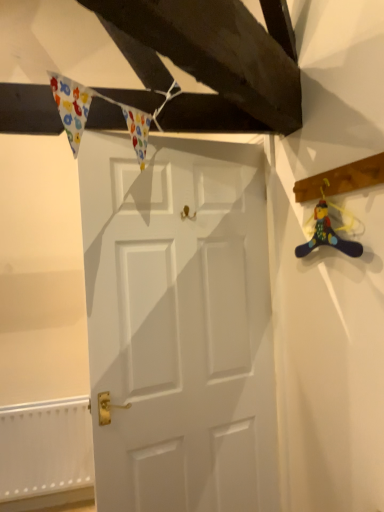
Question: Is wooden plank at upper right positioned behind white matte door at center?

Choices:
 (A) yes
 (B) no

Answer: (B)

Question: Is wooden plank at upper right outside white matte door at center?

Choices:
 (A) yes
 (B) no

Answer: (A)

Question: Is there a large distance between wooden plank at upper right and white matte door at center?

Choices:
 (A) no
 (B) yes

Answer: (A)

Question: Considering the relative positions of wooden plank at upper right and white matte door at center in the image provided, is wooden plank at upper right to the right of white matte door at center from the viewer's perspective?

Choices:
 (A) no
 (B) yes

Answer: (B)

Question: From a real-world perspective, is wooden plank at upper right on top of white matte door at center?

Choices:
 (A) no
 (B) yes

Answer: (B)

Question: From the image's perspective, is wooden plank at upper right on white matte door at center?

Choices:
 (A) no
 (B) yes

Answer: (B)

Question: From the image's perspective, is wooden plank at upper right located beneath matte plastic toy at right?

Choices:
 (A) no
 (B) yes

Answer: (A)

Question: Is wooden plank at upper right at the left side of matte plastic toy at right?

Choices:
 (A) yes
 (B) no

Answer: (B)

Question: Is wooden plank at upper right positioned behind matte plastic toy at right?

Choices:
 (A) no
 (B) yes

Answer: (A)

Question: Is wooden plank at upper right far from matte plastic toy at right?

Choices:
 (A) no
 (B) yes

Answer: (A)

Question: Is wooden plank at upper right facing away from matte plastic toy at right?

Choices:
 (A) yes
 (B) no

Answer: (B)

Question: Is wooden plank at upper right aimed at matte plastic toy at right?

Choices:
 (A) yes
 (B) no

Answer: (B)

Question: Is white textured radiator at lower left turned away from matte plastic toy at right?

Choices:
 (A) no
 (B) yes

Answer: (A)